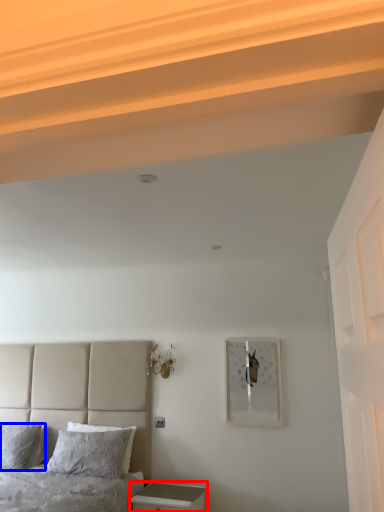
Question: Which object is further to the camera taking this photo, nightstand (highlighted by a red box) or pillow (highlighted by a blue box)?

Choices:
 (A) nightstand
 (B) pillow

Answer: (B)